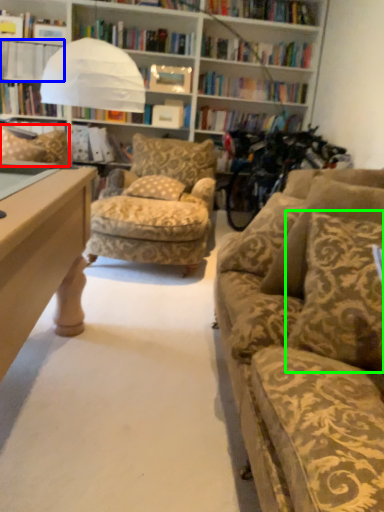
Question: Which object is positioned farthest from pillow (highlighted by a red box)? Select from book (highlighted by a blue box) and pillow (highlighted by a green box).

Choices:
 (A) book
 (B) pillow

Answer: (B)